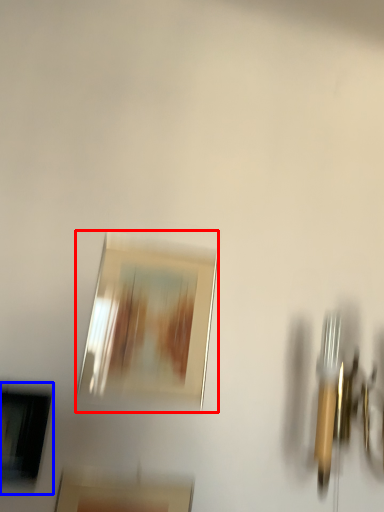
Question: Among these objects, which one is nearest to the camera, picture frame (highlighted by a red box) or picture frame (highlighted by a blue box)?

Choices:
 (A) picture frame
 (B) picture frame

Answer: (B)